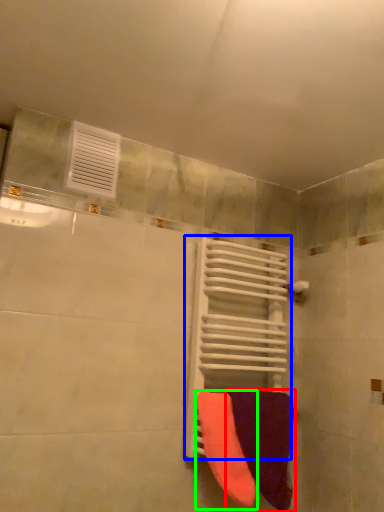
Question: Estimate the real-world distances between objects in this image. Which object is farther from towel (highlighted by a red box), radiator (highlighted by a blue box) or towel (highlighted by a green box)?

Choices:
 (A) radiator
 (B) towel

Answer: (A)